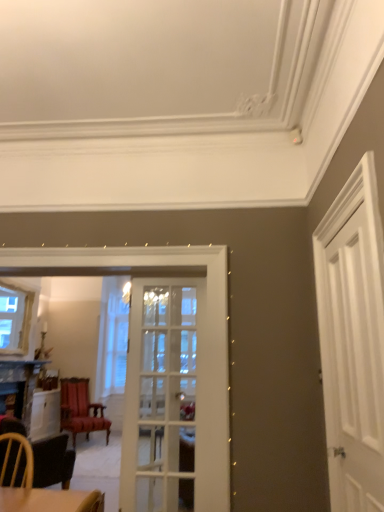
Question: Does white glass door at center, which ranks as the second door in right-to-left order, lie behind clear glass window at left?

Choices:
 (A) yes
 (B) no

Answer: (B)

Question: From the image's perspective, is white glass door at center, the 2th door when ordered from front to back, above clear glass window at left?

Choices:
 (A) no
 (B) yes

Answer: (A)

Question: Is the position of white glass door at center, which is the first door from left to right, less distant than that of clear glass window at left?

Choices:
 (A) yes
 (B) no

Answer: (A)

Question: Is white glass door at center, which ranks as the second door in right-to-left order, to the right of clear glass window at left from the viewer's perspective?

Choices:
 (A) yes
 (B) no

Answer: (A)

Question: From a real-world perspective, is white glass door at center, the 2th door when ordered from front to back, beneath clear glass window at left?

Choices:
 (A) no
 (B) yes

Answer: (B)

Question: Is point (135, 335) positioned closer to the camera than point (380, 333)?

Choices:
 (A) farther
 (B) closer

Answer: (A)

Question: Is white glass door at center, which is the first door from left to right, to the left or to the right of white wooden door at right, placed as the 1th door when sorted from front to back, in the image?

Choices:
 (A) right
 (B) left

Answer: (B)

Question: From the image's perspective, is white glass door at center, which ranks as the second door in right-to-left order, positioned above or below white wooden door at right, placed as the 1th door when sorted from front to back?

Choices:
 (A) below
 (B) above

Answer: (A)

Question: In terms of height, does white glass door at center, the 2th door when ordered from front to back, look taller or shorter compared to white wooden door at right, the second door positioned from the back?

Choices:
 (A) tall
 (B) short

Answer: (A)

Question: Visually, is white glass door at center, which ranks as the first door in back-to-front order, positioned to the left or to the right of velvet red chair at center?

Choices:
 (A) left
 (B) right

Answer: (B)

Question: Considering the positions of white glass door at center, which ranks as the first door in back-to-front order, and velvet red chair at center in the image, is white glass door at center, which ranks as the first door in back-to-front order, bigger or smaller than velvet red chair at center?

Choices:
 (A) small
 (B) big

Answer: (A)

Question: Is white glass door at center, which is the first door from left to right, in front of or behind velvet red chair at center in the image?

Choices:
 (A) behind
 (B) front

Answer: (B)

Question: Is white glass door at center, which ranks as the first door in back-to-front order, inside the boundaries of velvet red chair at center, or outside?

Choices:
 (A) inside
 (B) outside

Answer: (B)

Question: Is velvet red chair at center bigger or smaller than white wooden door at right, which is counted as the 1th door, starting from the right?

Choices:
 (A) small
 (B) big

Answer: (B)

Question: Is velvet red chair at center inside the boundaries of white wooden door at right, the second door positioned from the back, or outside?

Choices:
 (A) outside
 (B) inside

Answer: (A)